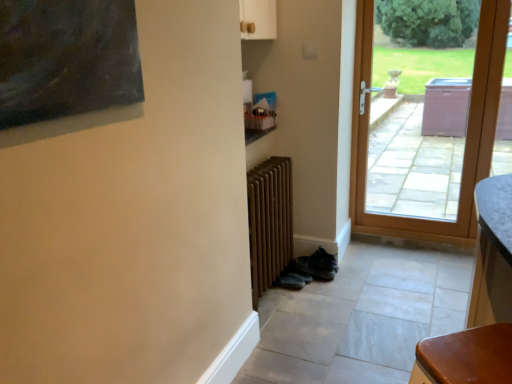
Identify the location of brown wooden radiator at center. Image resolution: width=512 pixels, height=384 pixels. (269, 222).

Measure the distance between point (268, 172) and camera.

The depth of point (268, 172) is 2.27 meters.

What do you see at coordinates (269, 222) in the screenshot? The height and width of the screenshot is (384, 512). I see `brown wooden radiator at center` at bounding box center [269, 222].

What is the approximate width of brown wooden door at right?

It is 9.71 centimeters.

Describe the element at coordinates (466, 136) in the screenshot. I see `brown wooden door at right` at that location.

You are a GUI agent. You are given a task and a screenshot of the screen. Output one action in this format:
    pyautogui.click(x=<x>, y=<y>)
    Task: Click on the brown wooden door at right
    This screenshot has width=512, height=384.
    Given the screenshot: What is the action you would take?
    pyautogui.click(x=466, y=136)

The width and height of the screenshot is (512, 384). Find the location of `brown wooden radiator at center`. brown wooden radiator at center is located at coordinates (269, 222).

Between brown wooden door at right and brown wooden radiator at center, which one appears on the left side from the viewer's perspective?

Positioned to the left is brown wooden radiator at center.

Considering the relative positions of brown wooden door at right and brown wooden radiator at center in the image provided, is brown wooden door at right in front of brown wooden radiator at center?

No, brown wooden door at right is further to the viewer.

Between point (414, 239) and point (252, 298), which one is positioned in front?

Positioned in front is point (252, 298).

From the image's perspective, is brown wooden door at right on top of brown wooden radiator at center?

Yes.

From a real-world perspective, which object rests below the other?

brown wooden radiator at center is physically lower.

Does brown wooden door at right have a lesser width compared to brown wooden radiator at center?

Yes, brown wooden door at right is thinner than brown wooden radiator at center.

Which of these two, brown wooden door at right or brown wooden radiator at center, stands taller?

With more height is brown wooden door at right.

Who is bigger, brown wooden door at right or brown wooden radiator at center?

With larger size is brown wooden door at right.

Can we say brown wooden door at right lies outside brown wooden radiator at center?

Yes, brown wooden door at right is located beyond the bounds of brown wooden radiator at center.

Is brown wooden door at right with brown wooden radiator at center?

No, brown wooden door at right is not touching brown wooden radiator at center.

Could you tell me if brown wooden door at right is facing brown wooden radiator at center?

No.

Locate an element on the screen. The width and height of the screenshot is (512, 384). door behind the brown wooden radiator at center is located at coordinates (466, 136).

Is brown wooden radiator at center at the right side of brown wooden door at right?

No, brown wooden radiator at center is not to the right of brown wooden door at right.

Which object is further away from the camera, brown wooden radiator at center or brown wooden door at right?

Positioned behind is brown wooden door at right.

Is point (275, 189) behind point (357, 66)?

No, it is not.

From the image's perspective, is brown wooden radiator at center located beneath brown wooden door at right?

Indeed, from the image's perspective, brown wooden radiator at center is shown beneath brown wooden door at right.

Looking at this image, from a real-world perspective, is brown wooden radiator at center positioned above or below brown wooden door at right?

From a real-world perspective, brown wooden radiator at center is physically below brown wooden door at right.

Which of these two, brown wooden radiator at center or brown wooden door at right, is thinner?

With smaller width is brown wooden door at right.

Considering the relative sizes of brown wooden radiator at center and brown wooden door at right in the image provided, is brown wooden radiator at center shorter than brown wooden door at right?

Yes.

Who is smaller, brown wooden radiator at center or brown wooden door at right?

With smaller size is brown wooden radiator at center.

Would you say brown wooden radiator at center is inside or outside brown wooden door at right?

brown wooden radiator at center lies outside brown wooden door at right.

Are brown wooden radiator at center and brown wooden door at right making contact?

brown wooden radiator at center and brown wooden door at right are not in contact.

Could you tell me if brown wooden radiator at center is facing brown wooden door at right?

No.

Can you tell me how much brown wooden radiator at center and brown wooden door at right differ in facing direction?

88.2 degrees.

I want to click on radiator in front of the brown wooden door at right, so click(x=269, y=222).

This screenshot has width=512, height=384. What are the coordinates of `radiator below the brown wooden door at right (from the image's perspective)` in the screenshot? It's located at (269, 222).

I want to click on door lying above the brown wooden radiator at center (from the image's perspective), so tap(466, 136).